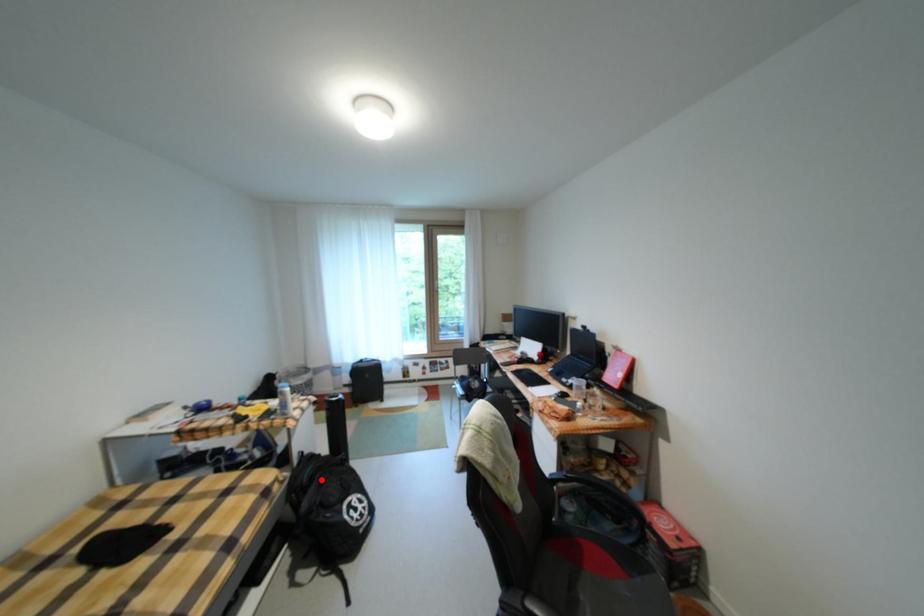
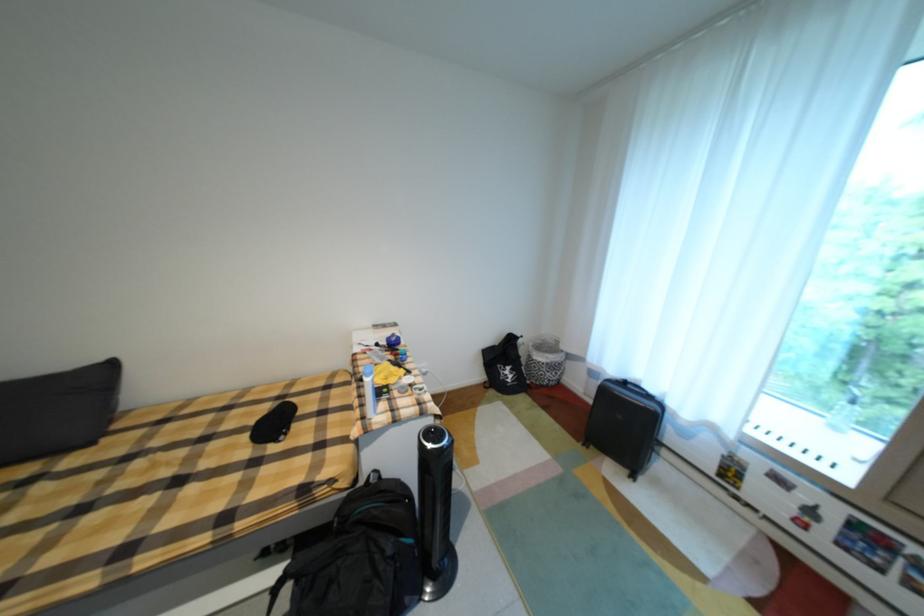
Question: I am providing you with two images of the same scene from different viewpoints. In image1, a red point is highlighted. Considering the same 3D point in image2, which of the following is correct?

Choices:
 (A) It is closer
 (B) It is farther

Answer: (B)